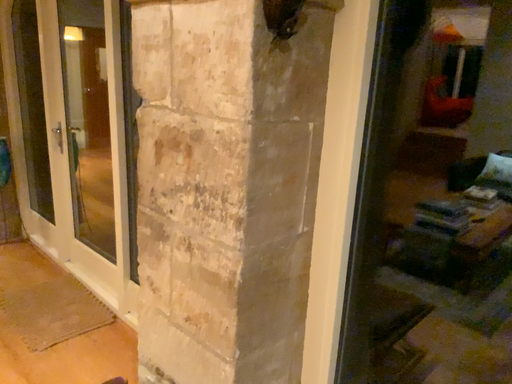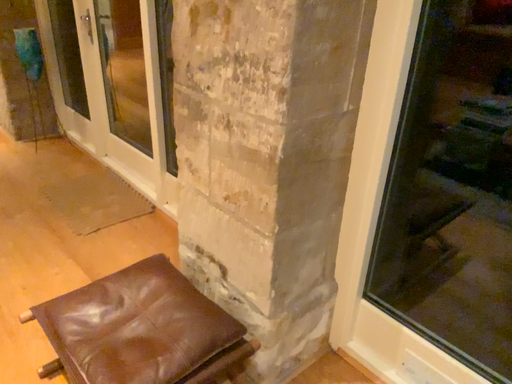
Question: Which way did the camera rotate in the video?

Choices:
 (A) rotated downward
 (B) rotated upward

Answer: (A)